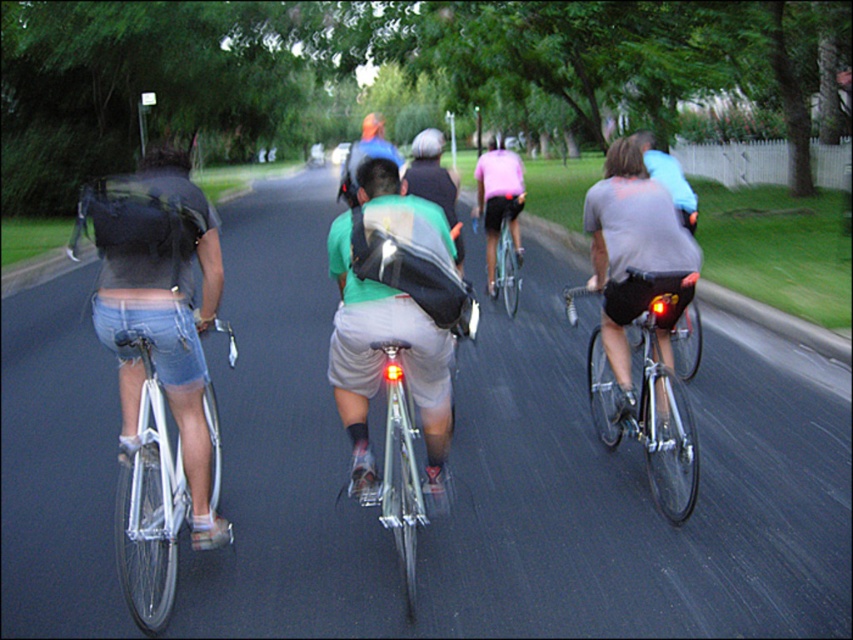
You are a photographer trying to capture a cyclist wearing a green fabric shirt at center and a silver metallic bicycle at left. Which cyclist should you focus on first to ensure they are in focus?

The green fabric shirt at center is closer to you than the silver metallic bicycle at left, so you should focus on the green fabric shirt at center first to ensure it is in focus.

You are a cyclist approaching the group from behind. You want to overtake the cyclist wearing the green fabric shirt at center. Based on their position, can you estimate whether you should move to the left or right side of the road to safely pass them?

The green fabric shirt at center is located at point 0.566 on the x and 0.450 on the y. Since the cyclists are spread out across the road width, you should move to the side opposite of their position to safely overtake. Given their coordinates, moving to the right side would provide enough space to pass safely.

You are a photographer positioned on the side of the road. You want to take a photo of the silver metallic bicycle at left and the shiny black bicycle at center. Based on their positions, which bicycle will appear larger in the photo?

The silver metallic bicycle at left will appear larger in the photo because it is closer to the viewer than the shiny black bicycle at center.